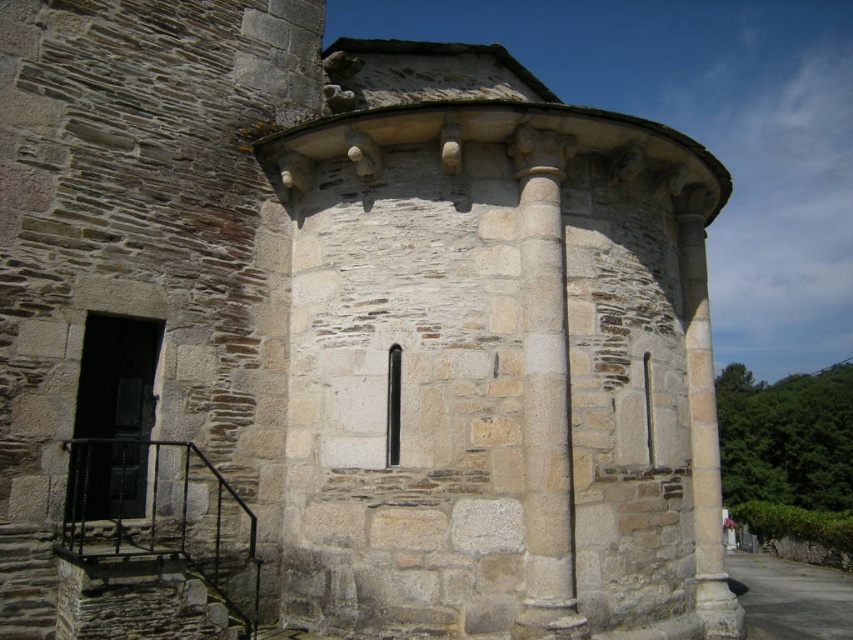
Does smooth stone column at center have a lesser width compared to rustic stone staircase at lower left?

Indeed, smooth stone column at center has a lesser width compared to rustic stone staircase at lower left.

Where is `smooth stone column at center`? The width and height of the screenshot is (853, 640). smooth stone column at center is located at coordinates (544, 392).

At what (x,y) coordinates should I click in order to perform the action: click on smooth stone column at center. Please return your answer as a coordinate pair (x, y). This screenshot has height=640, width=853. Looking at the image, I should click on (544, 392).